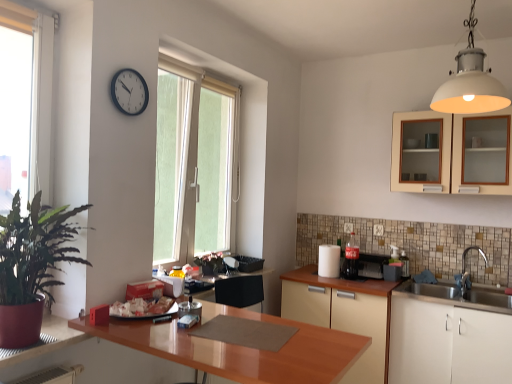
Describe the element at coordinates (473, 249) in the screenshot. I see `silver metallic faucet at lower right` at that location.

At what (x,y) coordinates should I click in order to perform the action: click on clear glass soda bottle at center-right, which ranks as the 2th appliance in right-to-left order. Please return your answer as a coordinate pair (x, y). The width and height of the screenshot is (512, 384). Looking at the image, I should click on (351, 258).

What are the coordinates of `green frosted glass window at center, arranged as the second window when viewed from the left` in the screenshot? It's located at (205, 154).

Locate an element on the screen. The height and width of the screenshot is (384, 512). green glass window at left, which is counted as the first window, starting from the left is located at coordinates (25, 103).

The image size is (512, 384). Describe the element at coordinates (31, 266) in the screenshot. I see `green leafy plant at left` at that location.

The height and width of the screenshot is (384, 512). Identify the location of glossy wood countertop at center. (241, 348).

From a real-world perspective, which object rests below the other?

clear glass soda bottle at center-right, which ranks as the 2th appliance in right-to-left order, from a real-world perspective.

What's the angular difference between clear glass soda bottle at center-right, which ranks as the second appliance in left-to-right order, and white matte light fixture at upper right's facing directions?

The angular difference between clear glass soda bottle at center-right, which ranks as the second appliance in left-to-right order, and white matte light fixture at upper right is 90 degrees.

Between point (345, 261) and point (471, 111), which one is positioned in front?

Point (471, 111)

Considering the sizes of clear glass soda bottle at center-right, which ranks as the second appliance in left-to-right order, and white matte light fixture at upper right in the image, is clear glass soda bottle at center-right, which ranks as the second appliance in left-to-right order, bigger or smaller than white matte light fixture at upper right?

In the image, clear glass soda bottle at center-right, which ranks as the second appliance in left-to-right order, appears to be smaller than white matte light fixture at upper right.

Which of these two, beige matte cabinet at lower center, the second cabinetry viewed from the top, or white paper towel at center, the 3th appliance from the right, is thinner?

With smaller width is white paper towel at center, the 3th appliance from the right.

Find the location of a particular element. The width and height of the screenshot is (512, 384). appliance on the left of beige matte cabinet at lower center, the second cabinetry viewed from the top is located at coordinates (329, 261).

How different are the orientations of beige matte cabinet at lower center, the second cabinetry viewed from the top, and white paper towel at center, the 3th appliance from the right, in degrees?

The facing directions of beige matte cabinet at lower center, the second cabinetry viewed from the top, and white paper towel at center, the 3th appliance from the right, are 0.000148 degrees apart.

Can you confirm if beige matte cabinet at lower center, the second cabinetry viewed from the top, is taller than white paper towel at center, the first appliance when ordered from left to right?

Yes, beige matte cabinet at lower center, the second cabinetry viewed from the top, is taller than white paper towel at center, the first appliance when ordered from left to right.

From the image's perspective, does green glass window at left, positioned as the 1th window in front-to-back order, appear lower than matte cream cabinet at upper right, the 1th cabinetry viewed from the top?

Indeed, from the image's perspective, green glass window at left, positioned as the 1th window in front-to-back order, is shown beneath matte cream cabinet at upper right, the 1th cabinetry viewed from the top.

Where is `the 3rd cabinetry to the right of the green glass window at left, which is counted as the first window, starting from the left, starting your count from the anchor`? The height and width of the screenshot is (384, 512). the 3rd cabinetry to the right of the green glass window at left, which is counted as the first window, starting from the left, starting your count from the anchor is located at coordinates (452, 153).

Considering the sizes of objects green glass window at left, arranged as the second window when viewed from the back, and matte cream cabinet at upper right, which is the 3th cabinetry from bottom to top, in the image provided, who is wider, green glass window at left, arranged as the second window when viewed from the back, or matte cream cabinet at upper right, which is the 3th cabinetry from bottom to top,?

matte cream cabinet at upper right, which is the 3th cabinetry from bottom to top, is wider.

Considering the relative positions of clear glass soda bottle at center-right, which ranks as the 2th appliance in right-to-left order, and white paper towel at center, the first appliance when ordered from left to right, in the image provided, is clear glass soda bottle at center-right, which ranks as the 2th appliance in right-to-left order, behind white paper towel at center, the first appliance when ordered from left to right,?

No, it is not.

Identify the location of appliance that is the 1st object directly below the clear glass soda bottle at center-right, which ranks as the second appliance in left-to-right order (from a real-world perspective). The width and height of the screenshot is (512, 384). (329, 261).

Between clear glass soda bottle at center-right, which ranks as the second appliance in left-to-right order, and white paper towel at center, the first appliance when ordered from left to right, which one has larger size?

white paper towel at center, the first appliance when ordered from left to right.

From the image's perspective, which one is positioned lower, clear glass soda bottle at center-right, which ranks as the second appliance in left-to-right order, or white paper towel at center, the first appliance when ordered from left to right?

white paper towel at center, the first appliance when ordered from left to right.

Between green leafy plant at left and silver metallic faucet at lower right, which one has smaller size?

silver metallic faucet at lower right is smaller.

Is green leafy plant at left oriented away from silver metallic faucet at lower right?

No, silver metallic faucet at lower right is not at the back of green leafy plant at left.

Relative to silver metallic faucet at lower right, is green leafy plant at left in front or behind?

green leafy plant at left is positioned closer to the viewer than silver metallic faucet at lower right.

In terms of size, does silver metallic faucet at lower right appear bigger or smaller than metallic silver toaster at right, the first appliance when ordered from right to left?

In the image, silver metallic faucet at lower right appears to be larger than metallic silver toaster at right, the first appliance when ordered from right to left.

From the image's perspective, is silver metallic faucet at lower right over metallic silver toaster at right, which is counted as the 3th appliance, starting from the left?

Yes, from the image's perspective, silver metallic faucet at lower right is over metallic silver toaster at right, which is counted as the 3th appliance, starting from the left.

Does silver metallic faucet at lower right have a lesser width compared to metallic silver toaster at right, the first appliance when ordered from right to left?

No.

Is silver metallic faucet at lower right at the right side of metallic silver toaster at right, the first appliance when ordered from right to left?

Yes.

In the image, is white matte light fixture at upper right positioned in front of or behind black plastic clock at upper center?

white matte light fixture at upper right is positioned closer to the viewer than black plastic clock at upper center.

Considering the sizes of white matte light fixture at upper right and black plastic clock at upper center in the image, is white matte light fixture at upper right wider or thinner than black plastic clock at upper center?

Clearly, white matte light fixture at upper right has more width compared to black plastic clock at upper center.

Visually, is white matte light fixture at upper right positioned to the left or to the right of black plastic clock at upper center?

white matte light fixture at upper right is to the right of black plastic clock at upper center.

From the picture: Can you confirm if white matte light fixture at upper right is smaller than black plastic clock at upper center?

No.

Where is `light fixture above the clear glass soda bottle at center-right, which ranks as the second appliance in left-to-right order (from a real-world perspective)`? This screenshot has width=512, height=384. light fixture above the clear glass soda bottle at center-right, which ranks as the second appliance in left-to-right order (from a real-world perspective) is located at coordinates (470, 82).

Where is `the 2nd appliance behind the beige matte cabinet at lower center, the second cabinetry viewed from the top`? the 2nd appliance behind the beige matte cabinet at lower center, the second cabinetry viewed from the top is located at coordinates (329, 261).

Which object lies nearer to the anchor point glossy wood countertop at center, clear glass soda bottle at center-right, which ranks as the 2th appliance in right-to-left order, or matte cream cabinet at upper right, the 1th cabinetry viewed from the top?

clear glass soda bottle at center-right, which ranks as the 2th appliance in right-to-left order, is closer to glossy wood countertop at center.

Which object lies nearer to the anchor point glossy wood countertop at center, green leafy plant at left or beige matte cabinet at lower center, marked as the second cabinetry in a bottom-to-top arrangement?

green leafy plant at left lies closer to glossy wood countertop at center than the other object.

From the picture: Which object lies further to the anchor point silver metallic faucet at lower right, green frosted glass window at center, which is the second window from front to back, or matte cream cabinet at upper right, which is the 3th cabinetry from bottom to top?

green frosted glass window at center, which is the second window from front to back, lies further to silver metallic faucet at lower right than the other object.

When comparing their distances from matte cream cabinet at upper right, which is the 3th cabinetry from bottom to top, does silver metallic faucet at lower right or metallic silver toaster at right, which is counted as the 3th appliance, starting from the left, seem further?

Among the two, metallic silver toaster at right, which is counted as the 3th appliance, starting from the left, is located further to matte cream cabinet at upper right, which is the 3th cabinetry from bottom to top.

Which object lies nearer to the anchor point silver metallic faucet at lower right, clear glass soda bottle at center-right, which ranks as the 2th appliance in right-to-left order, or green glass window at left, which is counted as the first window, starting from the left?

Based on the image, clear glass soda bottle at center-right, which ranks as the 2th appliance in right-to-left order, appears to be nearer to silver metallic faucet at lower right.

When comparing their distances from green glass window at left, positioned as the 1th window in front-to-back order, does metallic silver toaster at right, the first appliance when ordered from right to left, or white matte light fixture at upper right seem closer?

Among the two, white matte light fixture at upper right is located nearer to green glass window at left, positioned as the 1th window in front-to-back order.

Considering their positions, is beige matte cabinet at lower center, the second cabinetry viewed from the top, positioned further to matte cream cabinet at upper right, the 1th cabinetry viewed from the top, than green frosted glass window at center, which is counted as the 1th window, starting from the right?

green frosted glass window at center, which is counted as the 1th window, starting from the right, lies further to matte cream cabinet at upper right, the 1th cabinetry viewed from the top, than the other object.

Estimate the real-world distances between objects in this image. Which object is further from green glass window at left, arranged as the second window when viewed from the back, white paper towel at center, the 3th appliance from the right, or matte cream cabinet at upper right, which is the 3th cabinetry from bottom to top?

matte cream cabinet at upper right, which is the 3th cabinetry from bottom to top, is positioned further to the anchor green glass window at left, arranged as the second window when viewed from the back.

In order to click on light fixture between green glass window at left, positioned as the 1th window in front-to-back order, and silver metallic faucet at lower right from left to right in this screenshot , I will do `click(470, 82)`.

Where is `countertop between green glass window at left, which is counted as the first window, starting from the left, and white matte light fixture at upper right`? countertop between green glass window at left, which is counted as the first window, starting from the left, and white matte light fixture at upper right is located at coordinates (241, 348).

Locate an element on the screen. light fixture situated between green leafy plant at left and silver metallic faucet at lower right from left to right is located at coordinates (470, 82).

Identify the location of light fixture between green glass window at left, the 2th window positioned from the right, and metallic silver toaster at right, which is counted as the 3th appliance, starting from the left. (470, 82).